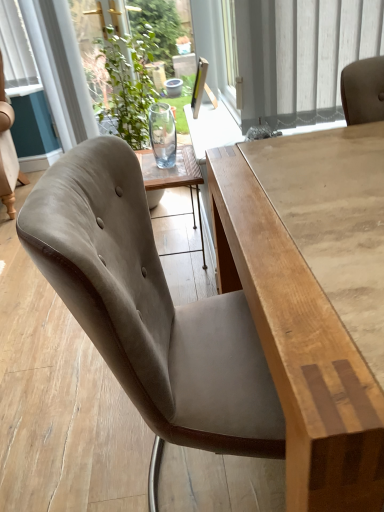
Locate an element on the screen. The width and height of the screenshot is (384, 512). free space above light brown wood table at center (from a real-world perspective) is located at coordinates (329, 185).